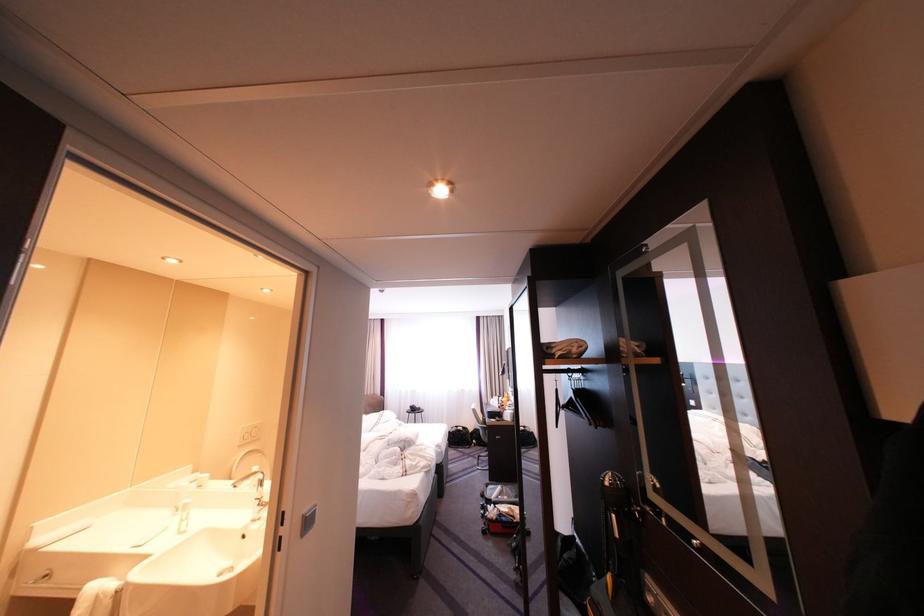
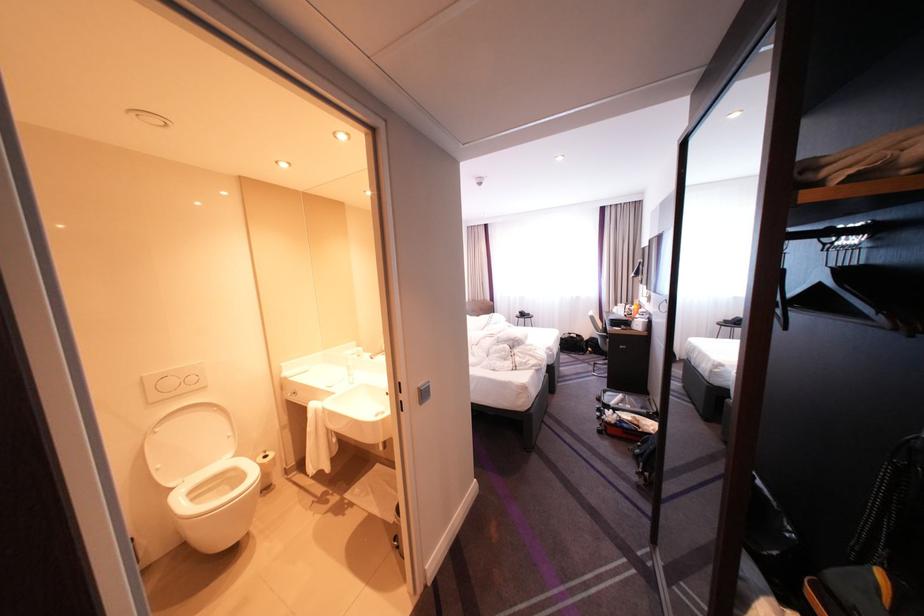
Consider the image. How did the camera likely rotate?

The camera rotated toward left-down.